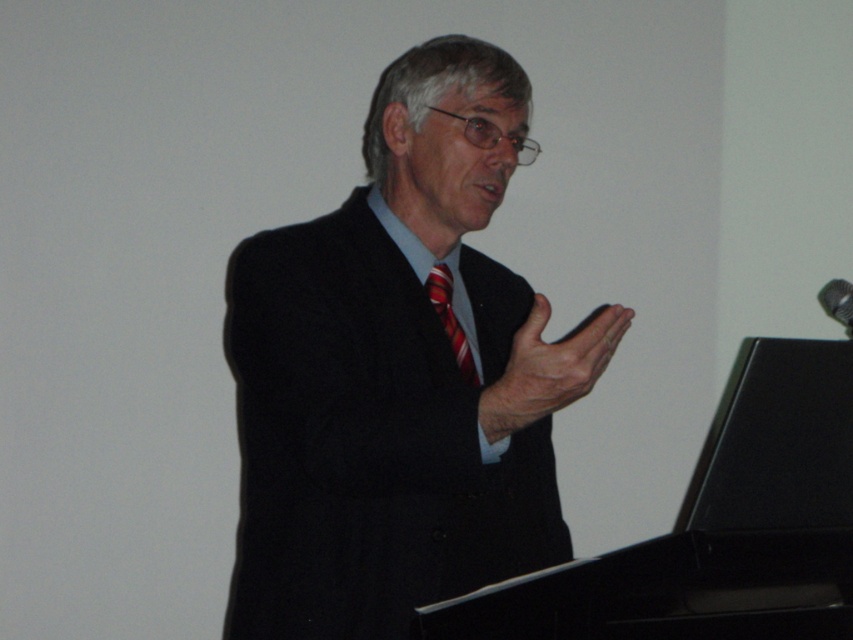
You are an event planner checking the speaker setup. You need to ensure the black matte suit at center and striped silk tie at center are visible to the audience. Based on their positions, which one will appear larger in the audience view?

The black matte suit at center will appear larger in the audience view because it is closer to the viewer than the striped silk tie at center.

You are an attendee sitting in the front row of the lecture hall. You notice two points marked in the image. One is at coordinate point [474,406] and the other is at coordinate point [840,284]. Which point is closer to you?

Point [474,406] is closer to the viewer than point [840,284].